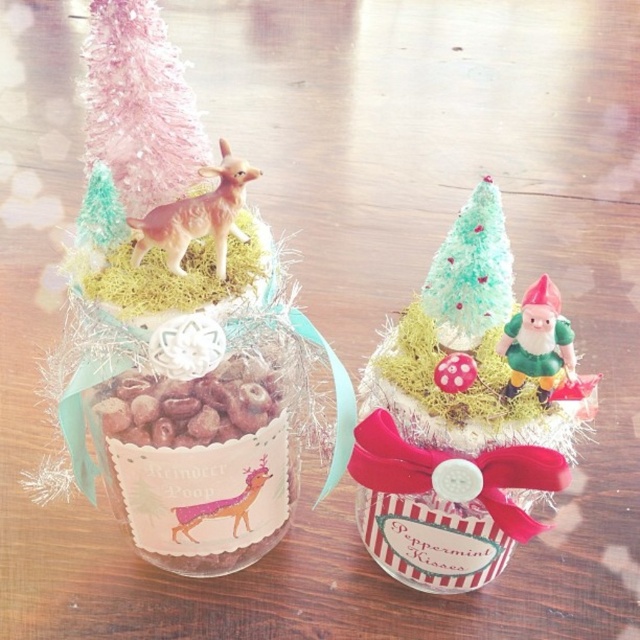
You are setting up a holiday display and want to place a 10 inch wide decorative box between the pink fluffy christmas tree at upper left and the frosted mint green christmas tree at center. Based on the spacing between them, will the box fit without overlapping either tree?

The distance between the pink fluffy christmas tree at upper left and the frosted mint green christmas tree at center is 10.41 inches. Since the box is 10 inches wide, it will fit between them without overlapping because the space is slightly larger than the box.

You are taking a photo of the two jars. You notice two points marked in the image. The first point is at coordinates point [122,136] and the second point is at point [225,509]. Which point will appear larger in your photo?

Point [122,136] will appear larger in the photo because it is closer to the camera than point [225,509].